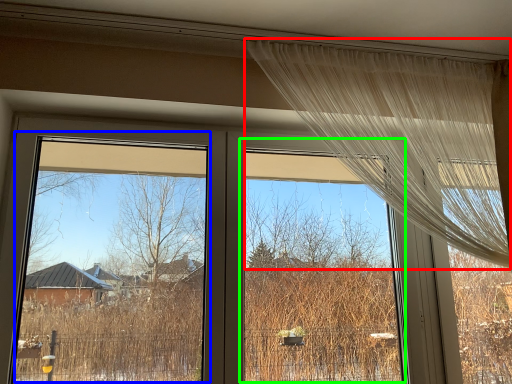
Question: Based on their relative distances, which object is nearer to curtain (highlighted by a red box)? Choose from window screen (highlighted by a blue box) and window screen (highlighted by a green box).

Choices:
 (A) window screen
 (B) window screen

Answer: (B)